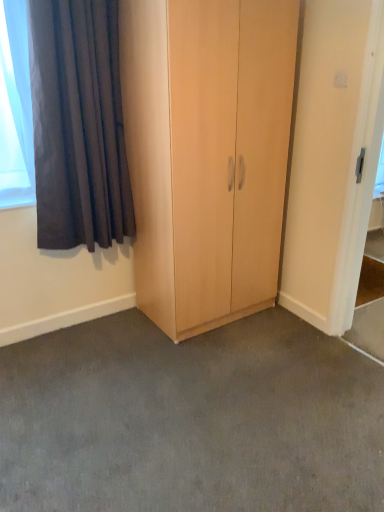
This screenshot has width=384, height=512. Identify the location of vacant space that is to the left of light wood cupboard at center. coord(105,335).